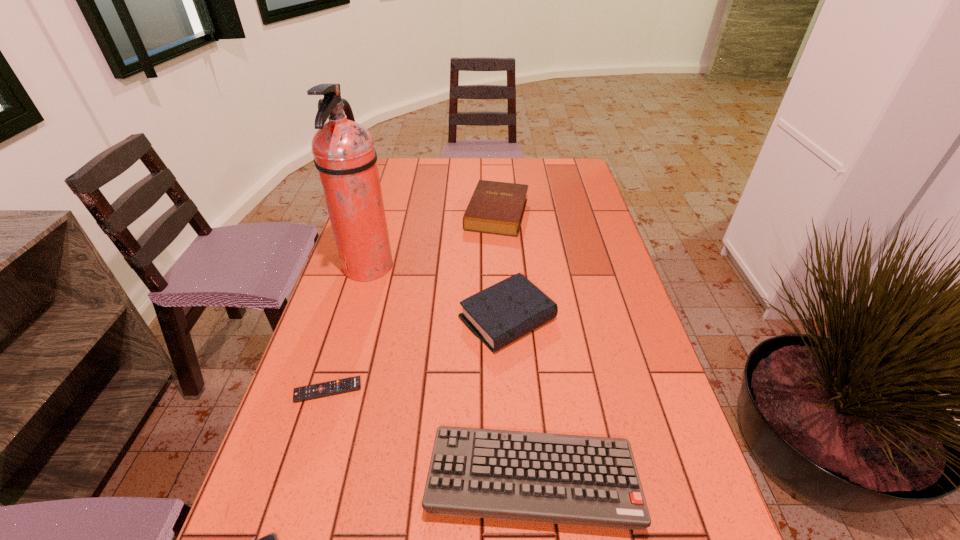
Locate an element on the screen. fire extinguisher is located at coordinates (344, 154).

I want to click on the farther Bible, so click(x=497, y=208).

Locate an element on the screen. The width and height of the screenshot is (960, 540). the nearer Bible is located at coordinates (504, 312).

Image resolution: width=960 pixels, height=540 pixels. In order to click on computer keyboard in this screenshot , I will do `click(499, 474)`.

You are a GUI agent. You are given a task and a screenshot of the screen. Output one action in this format:
    pyautogui.click(x=<x>, y=<y>)
    Task: Click on the second shortest object
    The width and height of the screenshot is (960, 540).
    Given the screenshot: What is the action you would take?
    pyautogui.click(x=319, y=390)

This screenshot has height=540, width=960. Identify the location of the fourth farthest object. (319, 390).

Where is `vacant space located 0.360m at the nozzle of the fire extinguisher`? vacant space located 0.360m at the nozzle of the fire extinguisher is located at coordinates (516, 268).

Find the location of a particular element. free location located on the front of the farther Bible is located at coordinates (499, 267).

Where is `free region located 0.260m on the back of the nearer Bible`? The width and height of the screenshot is (960, 540). free region located 0.260m on the back of the nearer Bible is located at coordinates pyautogui.click(x=502, y=233).

At what (x,y) coordinates should I click in order to perform the action: click on free spot located 0.050m on the left of the computer keyboard. Please return your answer as a coordinate pair (x, y). This screenshot has width=960, height=540. Looking at the image, I should click on (400, 478).